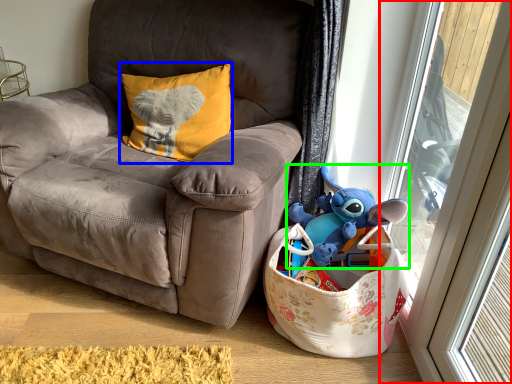
Question: Which object is the closest to the glass door (highlighted by a red box)? Choose among these: pillow (highlighted by a blue box) or toy (highlighted by a green box).

Choices:
 (A) pillow
 (B) toy

Answer: (B)